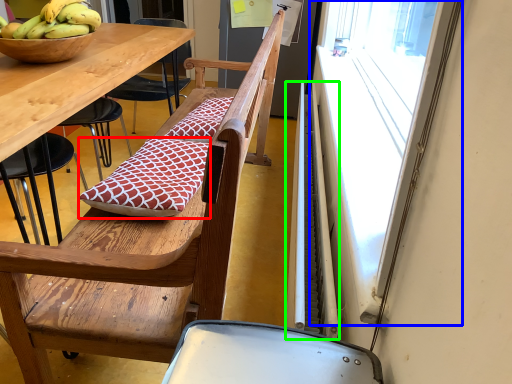
Question: Estimate the real-world distances between objects in this image. Which object is closer to pillow (highlighted by a red box), window screen (highlighted by a blue box) or radiator (highlighted by a green box)?

Choices:
 (A) window screen
 (B) radiator

Answer: (B)